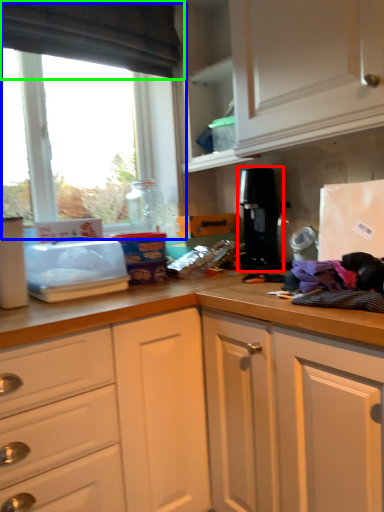
Question: Which object is positioned farthest from coffee machine (highlighted by a red box)? Select from window (highlighted by a blue box) and exhaust hood (highlighted by a green box).

Choices:
 (A) window
 (B) exhaust hood

Answer: (B)